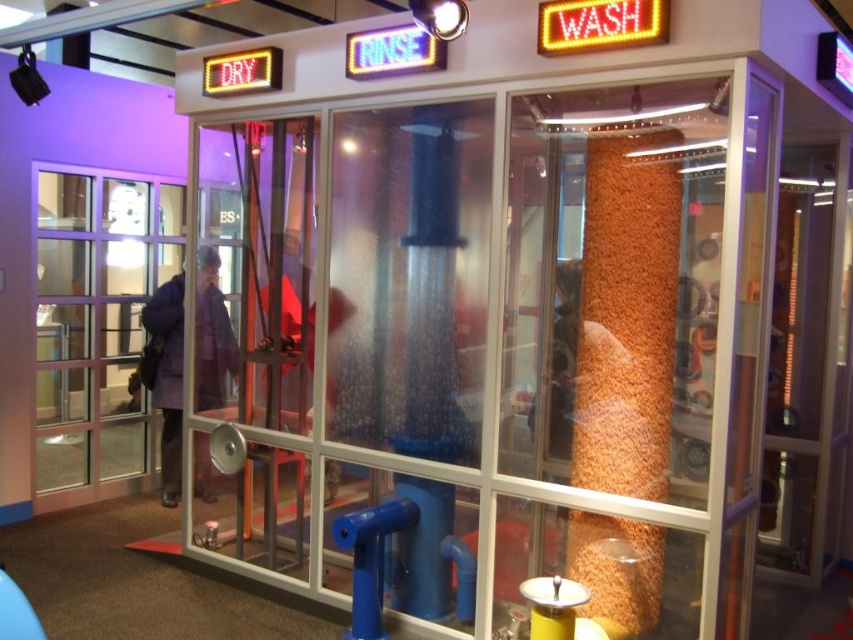
You are a visitor at the exhibit and want to see the purple fabric coat at center through the clear glass door at left. Is the door positioned in a way that allows you to view the coat without obstruction?

The clear glass door at left is above the purple fabric coat at center, so yes, you can see the purple fabric coat at center through the clear glass door at left since it is positioned above and not blocking the view.

You are a visitor at this exhibit and want to know if you can comfortably stand between the purple fabric coat at center and the matte red shirt at center without touching either. The average person is about 0.5 meters wide. Can you fit through the space between them?

The purple fabric coat at center and matte red shirt at center are 1.46 meters apart from each other. Since the average person is 0.5 meters wide, there would be sufficient space to stand between them without touching either item, as 1.46 meters is greater than 0.5 meters.

You are a visitor at this exhibit and want to touch both the clear glass door at left and the purple fabric coat at center. Which object should you approach first if you want to reach the larger one without moving too far from your current position?

The clear glass door at left is bigger than the purple fabric coat at center, so you should approach the clear glass door at left first since it is larger and closer to your current position.